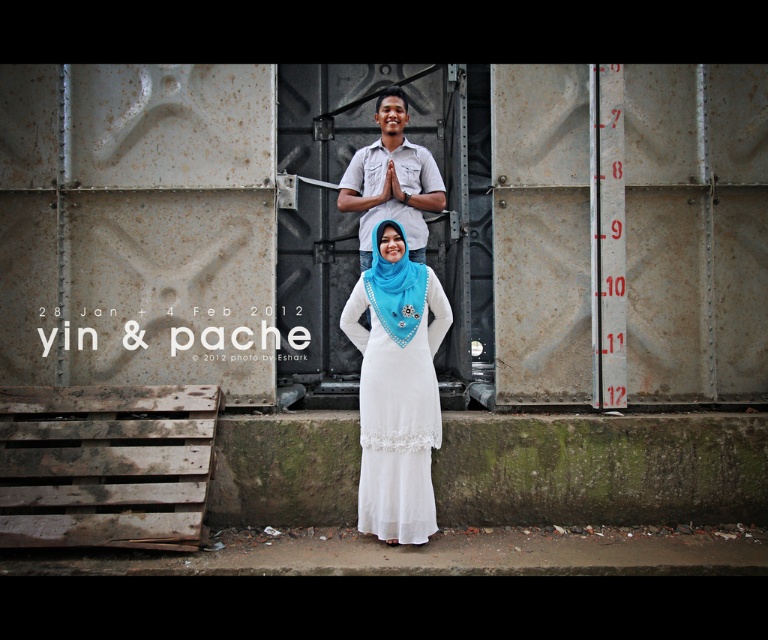
Question: Which of these objects is positioned closest to the matte white shirt at center?

Choices:
 (A) white sheer dress at center
 (B) blue satin headscarf at center

Answer: (B)

Question: Where is white sheer dress at center located in relation to blue satin headscarf at center in the image?

Choices:
 (A) below
 (B) above

Answer: (A)

Question: Which of the following is the farthest from the observer?

Choices:
 (A) blue satin headscarf at center
 (B) white sheer dress at center
 (C) matte white shirt at center

Answer: (C)

Question: Is white sheer dress at center in front of matte white shirt at center?

Choices:
 (A) no
 (B) yes

Answer: (B)

Question: Which point is closer to the camera?

Choices:
 (A) blue satin headscarf at center
 (B) matte white shirt at center

Answer: (A)

Question: Does white sheer dress at center have a smaller size compared to blue satin headscarf at center?

Choices:
 (A) no
 (B) yes

Answer: (A)